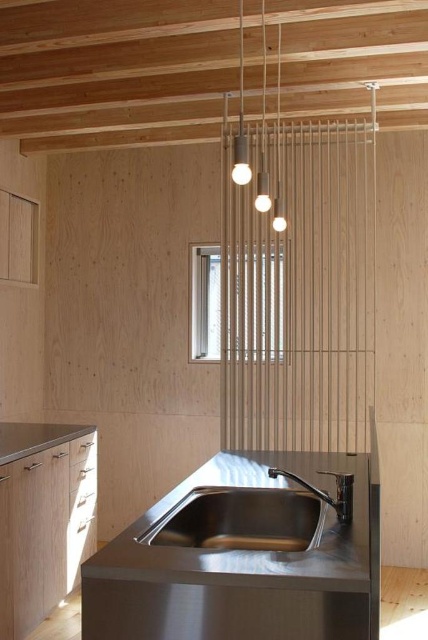
Question: Which is farther from the stainless steel sink at center?

Choices:
 (A) satin nickel faucet at lower center
 (B) stainless steel sink at lower left
 (C) matte wood exhaust hood at upper center

Answer: (C)

Question: Among these points, which one is farthest from the camera?

Choices:
 (A) (184, 512)
 (B) (64, 429)
 (C) (344, 72)
 (D) (321, 470)

Answer: (B)

Question: Does matte wood exhaust hood at upper center appear over stainless steel sink at center?

Choices:
 (A) no
 (B) yes

Answer: (B)

Question: Can you confirm if matte wood exhaust hood at upper center is bigger than stainless steel sink at lower left?

Choices:
 (A) yes
 (B) no

Answer: (A)

Question: Among these points, which one is nearest to the camera?

Choices:
 (A) (360, 109)
 (B) (303, 483)
 (C) (291, 522)
 (D) (14, 433)

Answer: (B)

Question: Is matte wood exhaust hood at upper center thinner than satin nickel faucet at lower center?

Choices:
 (A) yes
 (B) no

Answer: (B)